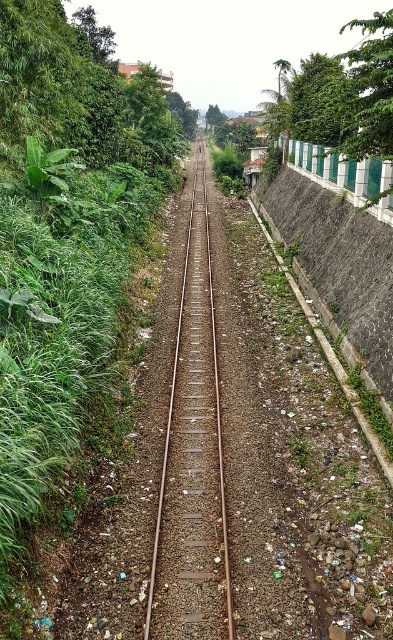
Question: Is green leafy vegetation at center closer to camera compared to rusty metal train track at center?

Choices:
 (A) yes
 (B) no

Answer: (A)

Question: Is green leafy vegetation at center below rusty metal train track at center?

Choices:
 (A) yes
 (B) no

Answer: (B)

Question: Is the position of green leafy vegetation at center less distant than that of rusty metal train track at center?

Choices:
 (A) no
 (B) yes

Answer: (B)

Question: Which point is farther to the camera?

Choices:
 (A) (152, 188)
 (B) (181, 602)

Answer: (A)

Question: Which point is closer to the camera taking this photo?

Choices:
 (A) click(218, 477)
 (B) click(62, 422)

Answer: (B)

Question: Among these points, which one is nearest to the camera?

Choices:
 (A) (196, 358)
 (B) (55, 314)

Answer: (B)